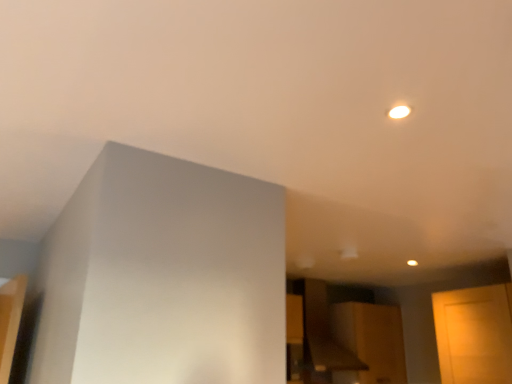
The image size is (512, 384). What do you see at coordinates (370, 341) in the screenshot? I see `matte wood cabinet at lower right` at bounding box center [370, 341].

At what (x,y) coordinates should I click in order to perform the action: click on matte wood cabinet at lower right. Please return your answer as a coordinate pair (x, y). The image size is (512, 384). Looking at the image, I should click on (370, 341).

Where is `matte wood cabinet at lower right`? matte wood cabinet at lower right is located at coordinates coord(370,341).